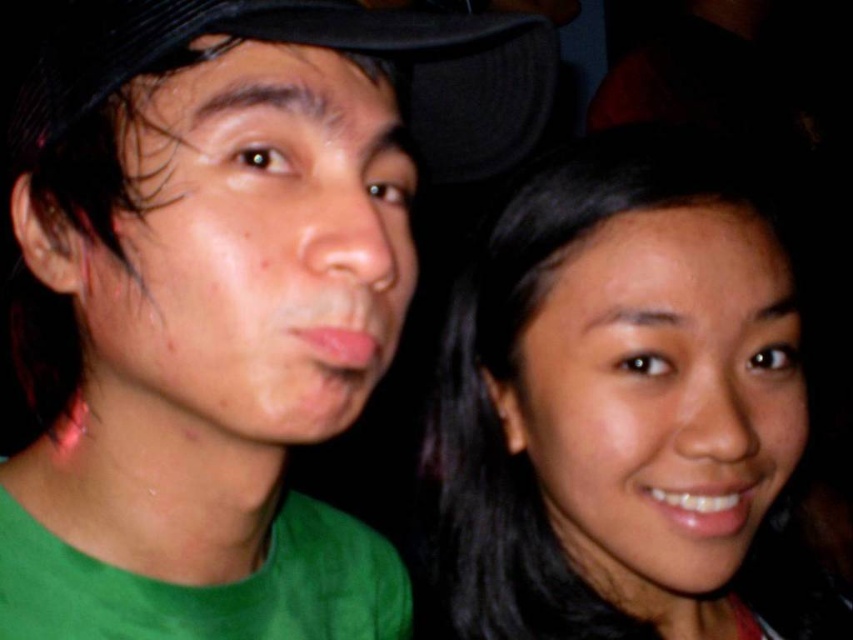
Question: Considering the real-world distances, which object is closest to the black fabric cap at upper center?

Choices:
 (A) smooth skin face at right
 (B) green matte shirt at left

Answer: (B)

Question: Can you confirm if green matte shirt at left is positioned to the right of black fabric cap at upper center?

Choices:
 (A) no
 (B) yes

Answer: (A)

Question: Can you confirm if green matte shirt at left is positioned to the left of black fabric cap at upper center?

Choices:
 (A) yes
 (B) no

Answer: (A)

Question: Which point is closer to the camera taking this photo?

Choices:
 (A) (134, 426)
 (B) (593, 538)

Answer: (A)

Question: Can you confirm if smooth skin face at right is positioned above black fabric cap at upper center?

Choices:
 (A) yes
 (B) no

Answer: (B)

Question: Which point appears closest to the camera in this image?

Choices:
 (A) (567, 470)
 (B) (146, 54)

Answer: (B)